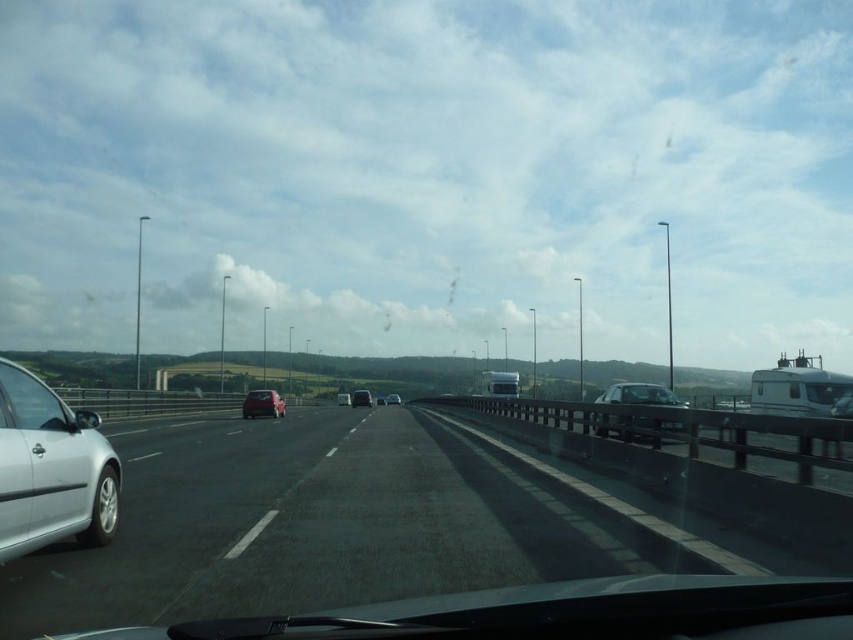
Can you confirm if matte red car at center is smaller than silver metallic sedan at center?

Incorrect, matte red car at center is not smaller in size than silver metallic sedan at center.

Is point (341, 392) positioned in front of point (379, 401)?

No, (341, 392) is behind (379, 401).

Does point (345, 401) lie behind point (376, 396)?

That is False.

At what (x,y) coordinates should I click in order to perform the action: click on matte red car at center. Please return your answer as a coordinate pair (x, y). Looking at the image, I should click on (343, 397).

Is point (650, 419) positioned in front of point (367, 394)?

Yes, point (650, 419) is closer to viewer.

Does shiny silver sedan at center have a lesser height compared to matte black van at center?

Correct, shiny silver sedan at center is not as tall as matte black van at center.

Where is `shiny silver sedan at center`? The width and height of the screenshot is (853, 640). shiny silver sedan at center is located at coordinates (639, 394).

Can you confirm if metallic silver van at center is positioned below matte red car at center?

Incorrect, metallic silver van at center is not positioned below matte red car at center.

This screenshot has height=640, width=853. Describe the element at coordinates (262, 404) in the screenshot. I see `metallic silver van at center` at that location.

What do you see at coordinates (262, 404) in the screenshot? The width and height of the screenshot is (853, 640). I see `metallic silver van at center` at bounding box center [262, 404].

The image size is (853, 640). What are the coordinates of `metallic silver van at center` in the screenshot? It's located at (262, 404).